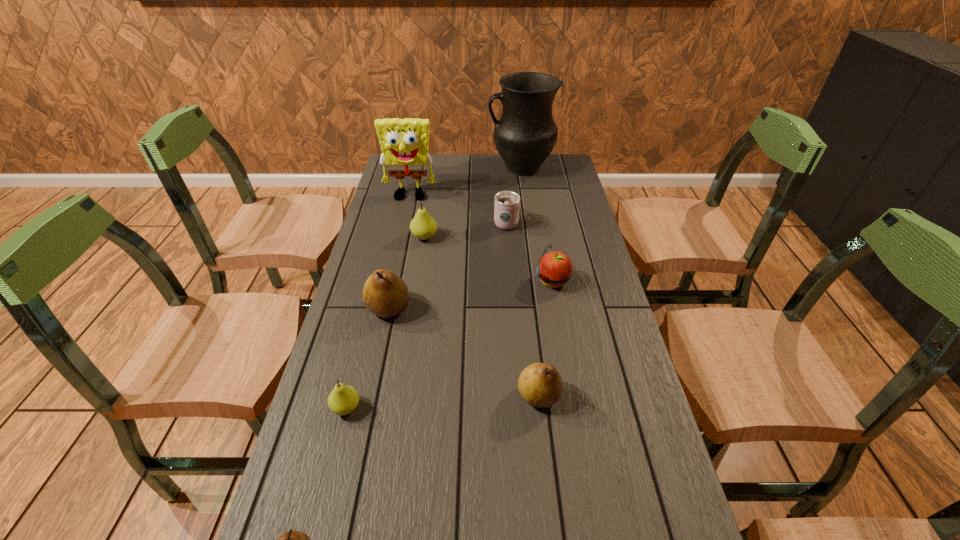
Choose which pear is the second nearest neighbor to the nearest pear. Please provide its 2D coordinates. Your answer should be formatted as a tuple, i.e. [(x, y)], where the tuple contains the x and y coordinates of a point satisfying the conditions above.

[(540, 385)]

Locate which pear ranks second in proximity to the eighth shortest object. Please provide its 2D coordinates. Your answer should be formatted as a tuple, i.e. [(x, y)], where the tuple contains the x and y coordinates of a point satisfying the conditions above.

[(385, 294)]

Identify which brown pear is the second nearest to the nearest object. Please provide its 2D coordinates. Your answer should be formatted as a tuple, i.e. [(x, y)], where the tuple contains the x and y coordinates of a point satisfying the conditions above.

[(385, 294)]

Locate which brown pear is the third closest to the left green pear. Please provide its 2D coordinates. Your answer should be formatted as a tuple, i.e. [(x, y)], where the tuple contains the x and y coordinates of a point satisfying the conditions above.

[(540, 385)]

Locate an element on the screen. free location that satisfies the following two spatial constraints: 1. on the handle side of the black pitcher; 2. on the face of the eighth shortest object is located at coordinates (524, 198).

The width and height of the screenshot is (960, 540). In order to click on free space that satisfies the following two spatial constraints: 1. on the handle side of the tallest object; 2. on the face of the sponge in this screenshot , I will do `click(524, 198)`.